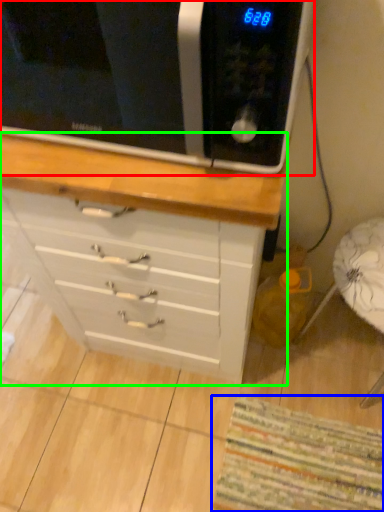
Question: Estimate the real-world distances between objects in this image. Which object is closer to microwave oven (highlighted by a red box), mat (highlighted by a blue box) or chest of drawers (highlighted by a green box)?

Choices:
 (A) mat
 (B) chest of drawers

Answer: (B)